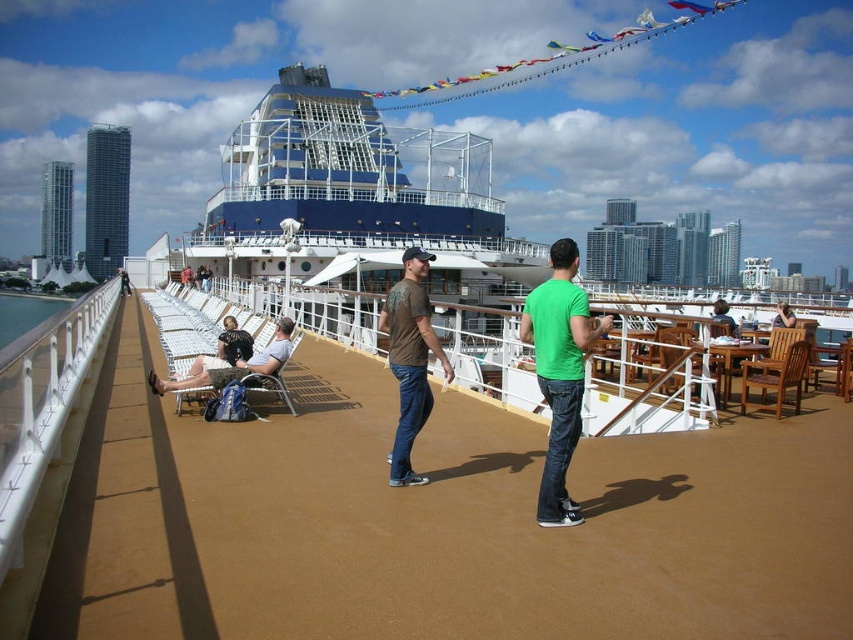
Can you confirm if brown smooth deck at center is thinner than dark brown leather chairs at center?

No.

Find the location of a particular element. brown smooth deck at center is located at coordinates (437, 522).

Does brown cotton t-shirt at center come behind dark brown leather chairs at center?

No, brown cotton t-shirt at center is in front of dark brown leather chairs at center.

Between brown cotton t-shirt at center and dark brown leather chairs at center, which one is positioned higher?

dark brown leather chairs at center is above.

Is point (416, 307) positioned behind point (190, 269)?

No, it is not.

Image resolution: width=853 pixels, height=640 pixels. What are the coordinates of `brown cotton t-shirt at center` in the screenshot? It's located at (410, 358).

Does brown cotton t-shirt at center appear under matte black shorts at center?

No.

Does brown cotton t-shirt at center lie in front of matte black shorts at center?

Yes, it is in front of matte black shorts at center.

Measure the distance between point [416,323] and camera.

Point [416,323] and camera are 28.87 meters apart from each other.

This screenshot has height=640, width=853. I want to click on brown cotton t-shirt at center, so click(410, 358).